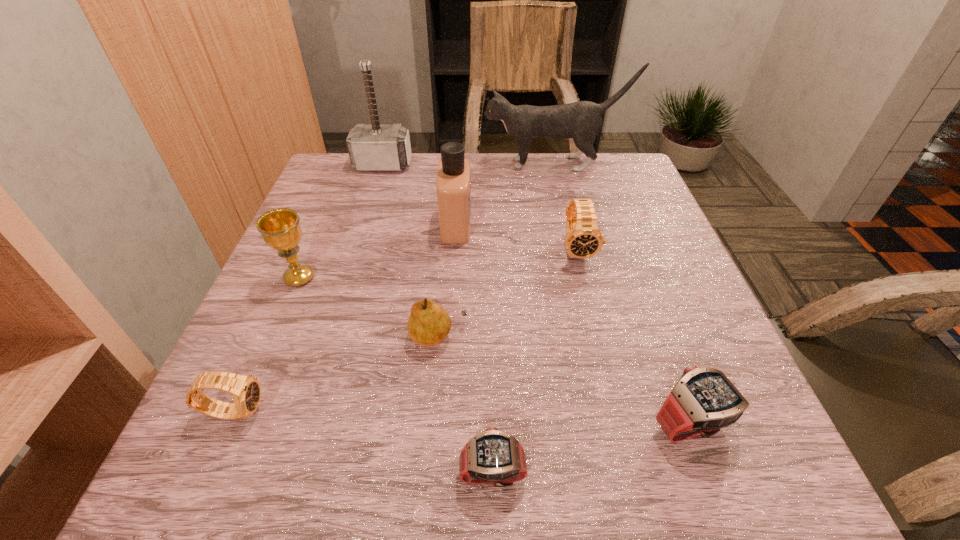
Locate an element on the screen. The image size is (960, 540). empty space that is in between the left black watch and the hammer is located at coordinates (309, 288).

Identify the location of vacant region between the fourth nearest object and the bigger red watch. This screenshot has height=540, width=960. pyautogui.click(x=564, y=381).

Locate an element on the screen. The height and width of the screenshot is (540, 960). the seventh closest object relative to the leftmost watch is located at coordinates (374, 147).

Locate an element on the screen. the third closest object relative to the cat is located at coordinates (583, 239).

Where is `watch that is the nearest to the sixth farthest object`? The image size is (960, 540). watch that is the nearest to the sixth farthest object is located at coordinates (494, 457).

Identify which watch is the closest to the gold chalice. Please provide its 2D coordinates. Your answer should be formatted as a tuple, i.e. [(x, y)], where the tuple contains the x and y coordinates of a point satisfying the conditions above.

[(246, 391)]

Identify the location of vacant space that satisfies the following two spatial constraints: 1. for striking with the head of the hammer; 2. on the face of the left black watch. (307, 411).

This screenshot has width=960, height=540. What are the coordinates of `free space that satisfies the following two spatial constraints: 1. for striking with the head of the hammer; 2. on the left side of the smaller red watch` in the screenshot? It's located at (288, 472).

Where is `free space in the image that satisfies the following two spatial constraints: 1. for striking with the head of the shortest object; 2. on the left side of the hammer`? free space in the image that satisfies the following two spatial constraints: 1. for striking with the head of the shortest object; 2. on the left side of the hammer is located at coordinates (288, 472).

What are the coordinates of `blank space that satisfies the following two spatial constraints: 1. on the back side of the second watch from left to right; 2. on the front label of the seventh shortest object` in the screenshot? It's located at (488, 225).